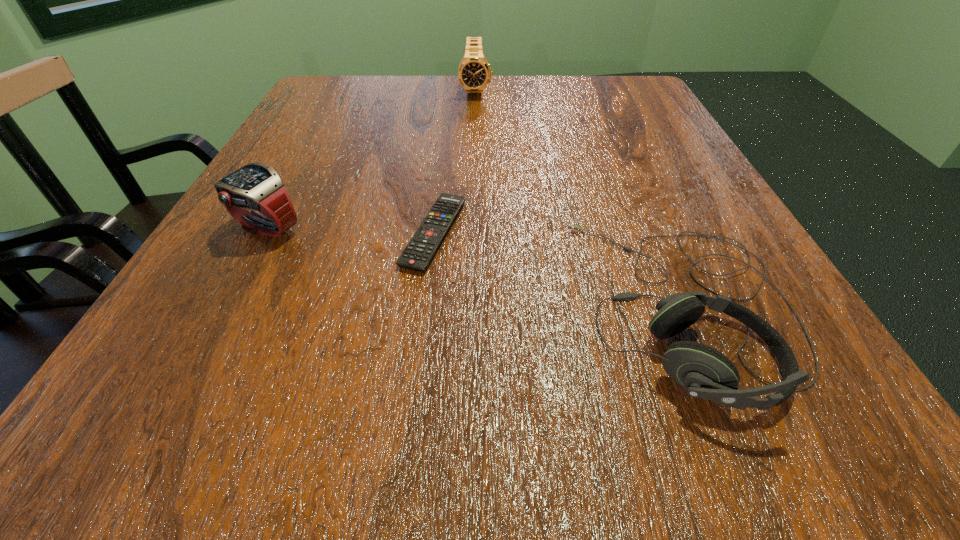
I want to click on free space located on the outer surface of the headset, so point(504,306).

Identify the location of free region located on the left of the shortest object. (338, 233).

This screenshot has height=540, width=960. I want to click on object that is at the far edge, so click(474, 72).

Locate an element on the screen. object that is at the near edge is located at coordinates (704, 372).

Locate an element on the screen. This screenshot has width=960, height=540. object positioned at the left edge is located at coordinates (256, 187).

At what (x,y) coordinates should I click in order to perform the action: click on object situated at the right edge. Please return your answer as a coordinate pair (x, y). Image resolution: width=960 pixels, height=540 pixels. Looking at the image, I should click on (704, 372).

You are a GUI agent. You are given a task and a screenshot of the screen. Output one action in this format:
    pyautogui.click(x=<x>, y=<y>)
    Task: Click on the object that is at the near right corner
    
    Given the screenshot: What is the action you would take?
    pyautogui.click(x=704, y=372)

Identify the location of blank space at the far edge. The width and height of the screenshot is (960, 540). coord(398,89).

Find the location of a particular element. The height and width of the screenshot is (540, 960). blank space at the left edge of the desktop is located at coordinates (283, 327).

Find the location of a particular element. The image size is (960, 540). free space at the right edge is located at coordinates (642, 141).